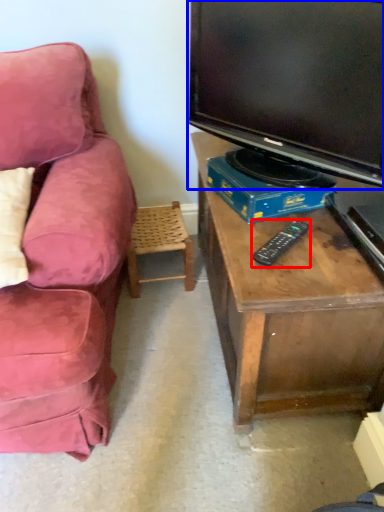
Question: Which object is closer to the camera taking this photo, remote (highlighted by a red box) or television (highlighted by a blue box)?

Choices:
 (A) remote
 (B) television

Answer: (B)